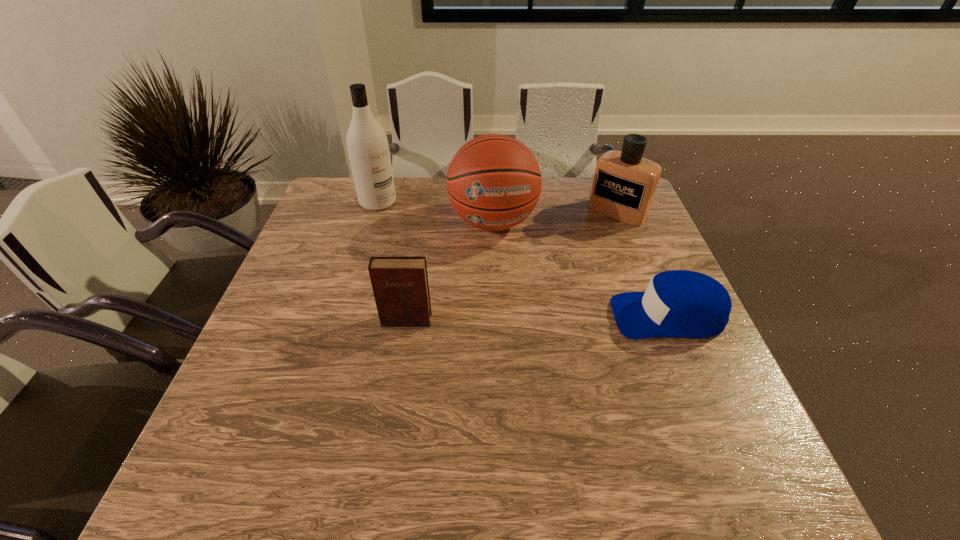
In order to click on the fourth tallest object in this screenshot , I will do `click(400, 285)`.

This screenshot has height=540, width=960. I want to click on the second object from left to right, so click(x=400, y=285).

The width and height of the screenshot is (960, 540). What are the coordinates of `the shortest object` in the screenshot? It's located at (678, 303).

This screenshot has width=960, height=540. Identify the location of basketball. (494, 181).

At what (x,y) coordinates should I click in order to perform the action: click on perfume. Please return your answer as a coordinate pair (x, y). Looking at the image, I should click on (624, 185).

The height and width of the screenshot is (540, 960). Find the location of `the leftmost object`. the leftmost object is located at coordinates (368, 149).

Image resolution: width=960 pixels, height=540 pixels. I want to click on shampoo, so click(368, 149).

You are a GUI agent. You are given a task and a screenshot of the screen. Output one action in this format:
    pyautogui.click(x=<x>, y=<y>)
    Task: Click on the vacant region located 0.050m on the front cover of the fourth tallest object
    The width and height of the screenshot is (960, 540).
    Given the screenshot: What is the action you would take?
    pyautogui.click(x=402, y=344)

Where is `vacant space situated on the front-facing side of the shortest object`? vacant space situated on the front-facing side of the shortest object is located at coordinates (540, 315).

Locate an element on the screen. The width and height of the screenshot is (960, 540). vacant space located on the front-facing side of the shortest object is located at coordinates (557, 315).